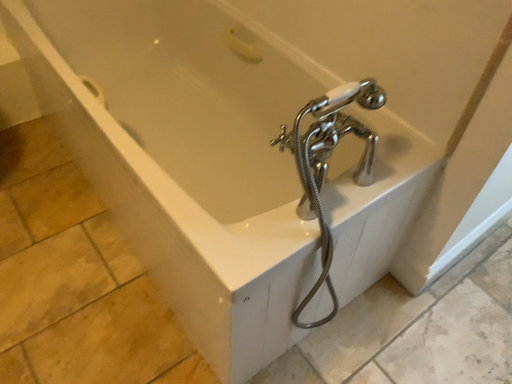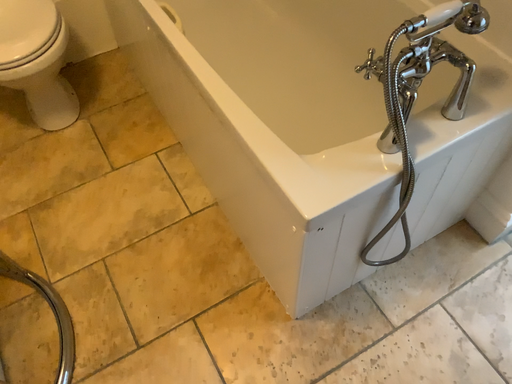
Question: How did the camera likely rotate when shooting the video?

Choices:
 (A) rotated left
 (B) rotated right

Answer: (A)